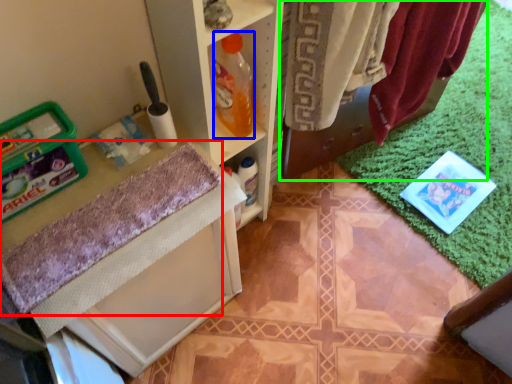
Question: Considering the real-world distances, which object is closest to bath towel (highlighted by a red box)? bottle (highlighted by a blue box) or laundry (highlighted by a green box).

Choices:
 (A) bottle
 (B) laundry

Answer: (A)